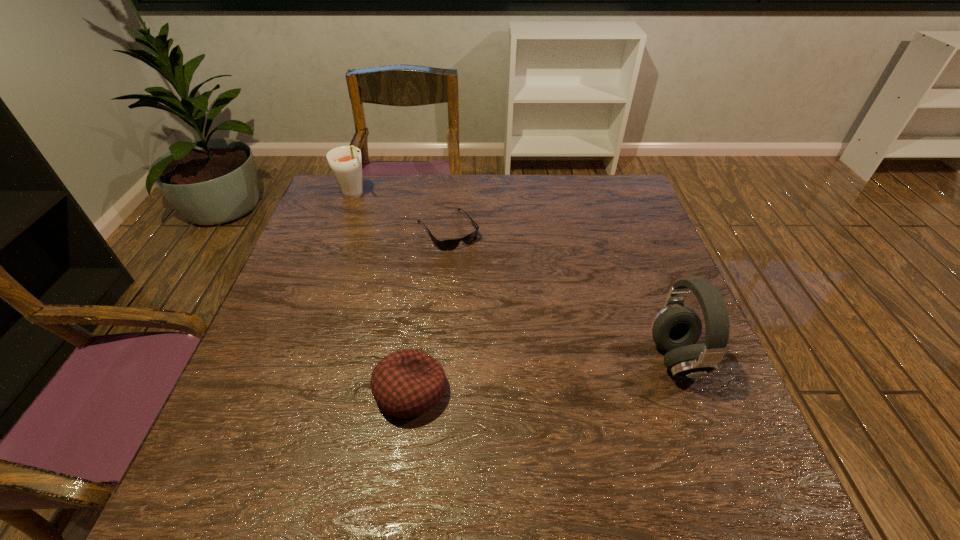
At what (x,y) coordinates should I click in order to perform the action: click on free space on the desktop that is between the second shortest object and the rightmost object and is positioned on the front-facing side of the sunglasses. Please return your answer as a coordinate pair (x, y). The image size is (960, 540). Looking at the image, I should click on (554, 374).

I want to click on free spot on the desktop that is between the third tallest object and the rightmost object and is positioned on the drink side of the farthest object, so click(x=517, y=378).